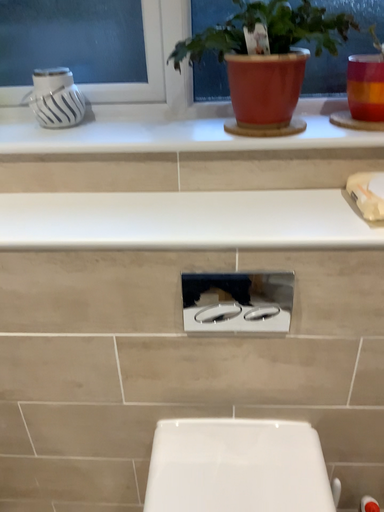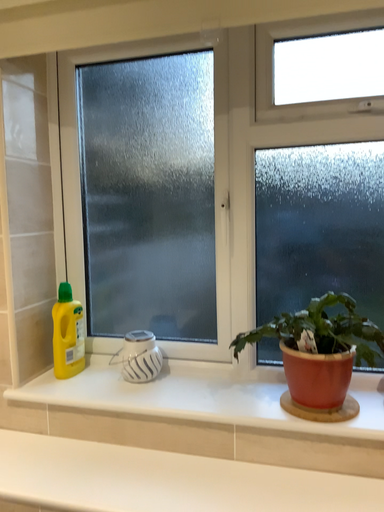
Question: How did the camera likely rotate when shooting the video?

Choices:
 (A) rotated left
 (B) rotated right

Answer: (A)